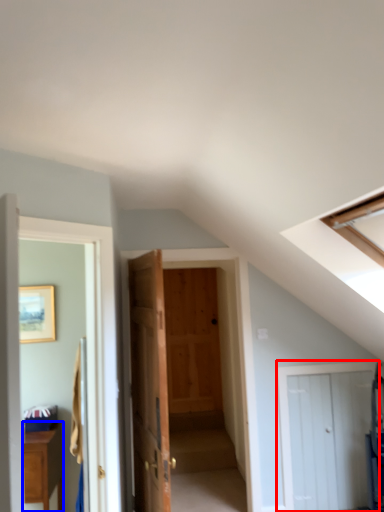
Question: Which object appears closest to the camera in this image, door (highlighted by a red box) or cabinetry (highlighted by a blue box)?

Choices:
 (A) door
 (B) cabinetry

Answer: (B)